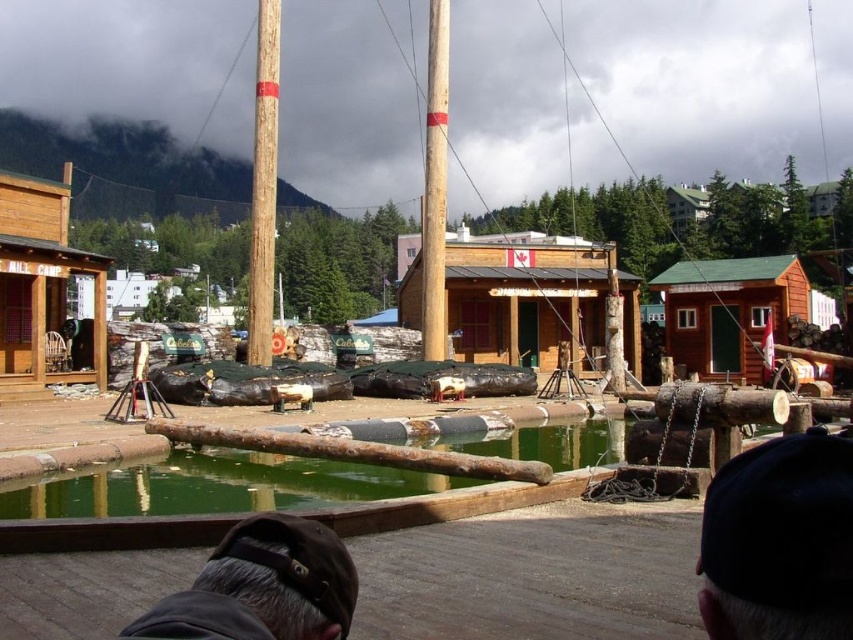
You are a visitor at this historical site and want to take a photo that includes both the wooden cabin at center and the smooth wooden pole at upper center. Which object should you position closer to the camera to ensure both are in frame?

The wooden cabin at center is bigger than the smooth wooden pole at upper center, so you should position the smooth wooden pole at upper center closer to the camera to ensure both are in frame.

You are planning to hang a large banner from the wooden cabin at center and the smooth wooden pole at upper center. Which object will allow the banner to hang higher above the ground?

The wooden cabin at center is taller than the smooth wooden pole at upper center, so hanging the banner from the wooden cabin at center will allow it to hang higher above the ground.